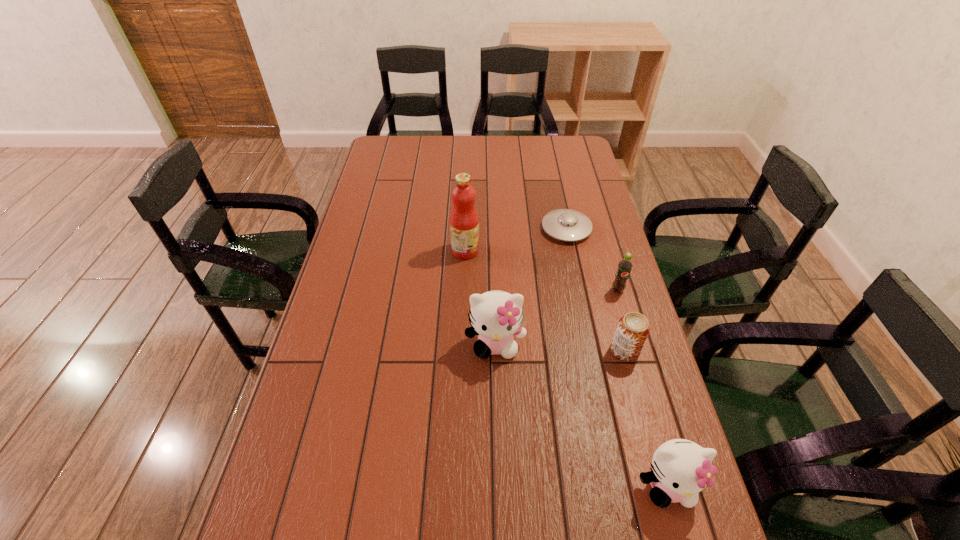
Please point a spot to add another kitten on the left. Please provide its 2D coordinates. Your answer should be formatted as a tuple, i.e. [(x, y)], where the tuple contains the x and y coordinates of a point satisfying the conditions above.

[(383, 251)]